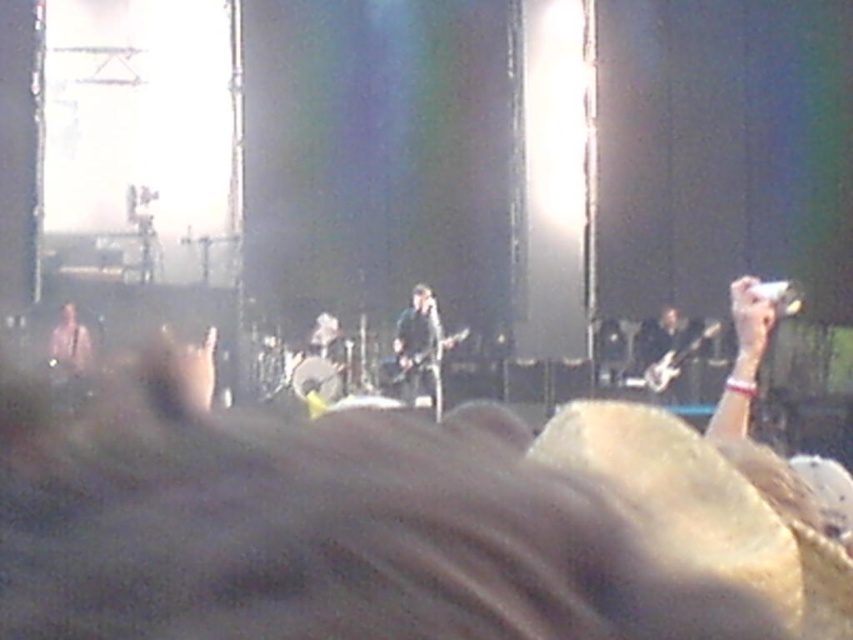
You are a photographer at the concert and want to capture a clear shot of the shiny black guitar at center without the matte black guitar at left blocking it. Based on their positions, is this possible?

Yes, the shiny black guitar at center is in front of the matte black guitar at left, so it should be possible to capture a clear shot of the shiny black guitar at center without obstruction from the matte black guitar at left.